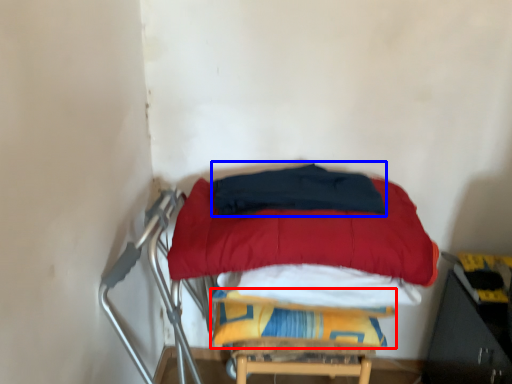
Question: Which object is further to the camera taking this photo, blanket (highlighted by a red box) or blanket (highlighted by a blue box)?

Choices:
 (A) blanket
 (B) blanket

Answer: (A)